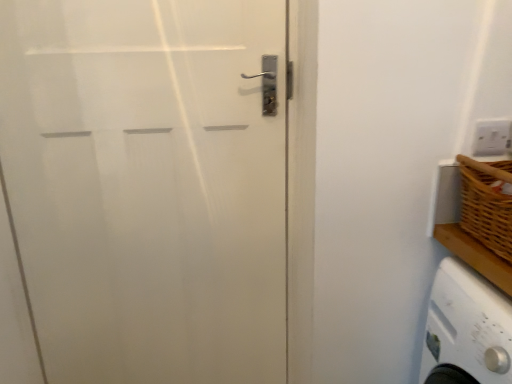
What do you see at coordinates (492, 137) in the screenshot? I see `white plastic electric outlet at upper right` at bounding box center [492, 137].

At what (x,y) coordinates should I click in order to perform the action: click on white plastic electric outlet at upper right. Please return your answer as a coordinate pair (x, y). The width and height of the screenshot is (512, 384). Looking at the image, I should click on (492, 137).

Consider the image. In order to face white plastic electric outlet at upper right, should I rotate leftwards or rightwards?

Turn right by 29.183 degrees to look at white plastic electric outlet at upper right.

Identify the location of white matte door at left. (149, 185).

Measure the distance between white matte door at left and camera.

The distance of white matte door at left from camera is 3.28 feet.

Describe the element at coordinates (149, 185) in the screenshot. I see `white matte door at left` at that location.

The width and height of the screenshot is (512, 384). Find the location of `white plastic electric outlet at upper right`. white plastic electric outlet at upper right is located at coordinates (492, 137).

Between white plastic electric outlet at upper right and white matte door at left, which one appears on the right side from the viewer's perspective?

Positioned to the right is white plastic electric outlet at upper right.

Is the depth of white plastic electric outlet at upper right less than that of white matte door at left?

No, it is not.

Considering the positions of points (485, 135) and (179, 146), is point (485, 135) closer to camera compared to point (179, 146)?

Yes, it is in front of point (179, 146).

From the image's perspective, is white plastic electric outlet at upper right positioned above or below white matte door at left?

Based on their image positions, white plastic electric outlet at upper right is located above white matte door at left.

From a real-world perspective, which is physically above, white plastic electric outlet at upper right or white matte door at left?

From a 3D spatial view, white plastic electric outlet at upper right is above.

Considering the sizes of objects white plastic electric outlet at upper right and white matte door at left in the image provided, who is wider, white plastic electric outlet at upper right or white matte door at left?

white matte door at left.

Considering the sizes of white plastic electric outlet at upper right and white matte door at left in the image, is white plastic electric outlet at upper right taller or shorter than white matte door at left?

white plastic electric outlet at upper right is shorter than white matte door at left.

Considering the relative sizes of white plastic electric outlet at upper right and white matte door at left in the image provided, is white plastic electric outlet at upper right smaller than white matte door at left?

Correct, white plastic electric outlet at upper right occupies less space than white matte door at left.

Is white plastic electric outlet at upper right not inside white matte door at left?

Yes, white plastic electric outlet at upper right is located beyond the bounds of white matte door at left.

Are white plastic electric outlet at upper right and white matte door at left making contact?

They are not placed beside each other.

Is white plastic electric outlet at upper right oriented away from white matte door at left?

white plastic electric outlet at upper right does not have its back to white matte door at left.

How many degrees apart are the facing directions of white plastic electric outlet at upper right and white matte door at left?

There is a 1.85-degree angle between the facing directions of white plastic electric outlet at upper right and white matte door at left.

How much distance is there between white plastic electric outlet at upper right and white matte door at left?

The distance of white plastic electric outlet at upper right from white matte door at left is 34.77 inches.

Image resolution: width=512 pixels, height=384 pixels. There is a white matte door at left. In order to click on electric outlet above it (from a real-world perspective) in this screenshot , I will do `click(492, 137)`.

Which is more to the right, white matte door at left or white plastic electric outlet at upper right?

white plastic electric outlet at upper right is more to the right.

Who is more distant, white matte door at left or white plastic electric outlet at upper right?

white plastic electric outlet at upper right.

Which is in front, point (147, 44) or point (501, 127)?

The point (501, 127) is closer to the camera.

From the image's perspective, is white matte door at left below white plastic electric outlet at upper right?

Correct, white matte door at left appears lower than white plastic electric outlet at upper right in the image.

From a real-world perspective, who is located lower, white matte door at left or white plastic electric outlet at upper right?

From a 3D spatial view, white matte door at left is below.

In the scene shown: Considering the relative sizes of white matte door at left and white plastic electric outlet at upper right in the image provided, is white matte door at left wider than white plastic electric outlet at upper right?

Yes, white matte door at left is wider than white plastic electric outlet at upper right.

In the scene shown: Who is taller, white matte door at left or white plastic electric outlet at upper right?

Standing taller between the two is white matte door at left.

Who is bigger, white matte door at left or white plastic electric outlet at upper right?

Bigger between the two is white matte door at left.

Can we say white matte door at left lies outside white plastic electric outlet at upper right?

Yes, white matte door at left is outside of white plastic electric outlet at upper right.

Is there a large distance between white matte door at left and white plastic electric outlet at upper right?

They are positioned close to each other.

Could you tell me if white matte door at left is facing white plastic electric outlet at upper right?

No, white matte door at left is not oriented towards white plastic electric outlet at upper right.

What's the angular difference between white matte door at left and white plastic electric outlet at upper right's facing directions?

1.85 degrees.

Find the location of a particular element. Image resolution: width=512 pixels, height=384 pixels. door in front of the white plastic electric outlet at upper right is located at coordinates (149, 185).

This screenshot has height=384, width=512. There is a white matte door at left. What are the coordinates of `electric outlet above it (from a real-world perspective)` in the screenshot? It's located at (492, 137).

The width and height of the screenshot is (512, 384). Identify the location of electric outlet above the white matte door at left (from the image's perspective). (492, 137).